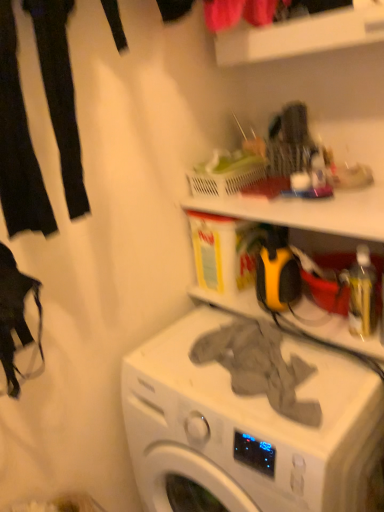
Question: Are gray fabric at center and translucent plastic basket at upper center located far from each other?

Choices:
 (A) no
 (B) yes

Answer: (A)

Question: Could you tell me if gray fabric at center is turned towards translucent plastic basket at upper center?

Choices:
 (A) yes
 (B) no

Answer: (B)

Question: From a real-world perspective, is gray fabric at center located beneath translucent plastic basket at upper center?

Choices:
 (A) yes
 (B) no

Answer: (A)

Question: Does gray fabric at center appear on the right side of translucent plastic basket at upper center?

Choices:
 (A) no
 (B) yes

Answer: (B)

Question: Does gray fabric at center have a greater width compared to translucent plastic basket at upper center?

Choices:
 (A) no
 (B) yes

Answer: (B)

Question: Is the position of gray fabric at center more distant than that of translucent plastic basket at upper center?

Choices:
 (A) yes
 (B) no

Answer: (B)

Question: From the image's perspective, is black fabric pants at left, which is the 1th clothing in left-to-right order, on translucent plastic basket at upper center?

Choices:
 (A) yes
 (B) no

Answer: (A)

Question: Can you confirm if black fabric pants at left, the second clothing from the right, is thinner than translucent plastic basket at upper center?

Choices:
 (A) no
 (B) yes

Answer: (B)

Question: Is black fabric pants at left, which is counted as the 1th clothing, starting from the top, to the right of translucent plastic basket at upper center from the viewer's perspective?

Choices:
 (A) yes
 (B) no

Answer: (B)

Question: Considering the relative positions of black fabric pants at left, the second clothing from the right, and translucent plastic basket at upper center in the image provided, is black fabric pants at left, the second clothing from the right, to the left of translucent plastic basket at upper center from the viewer's perspective?

Choices:
 (A) no
 (B) yes

Answer: (B)

Question: Does black fabric pants at left, which is the 1th clothing in left-to-right order, have a lesser height compared to translucent plastic basket at upper center?

Choices:
 (A) yes
 (B) no

Answer: (B)

Question: Is black fabric pants at left, the second clothing ordered from the bottom, positioned in front of translucent plastic basket at upper center?

Choices:
 (A) no
 (B) yes

Answer: (B)

Question: Is black fabric pants at left, which is the 1th clothing in left-to-right order, facing towards gray fabric at center, acting as the 1th clothing starting from the right?

Choices:
 (A) yes
 (B) no

Answer: (B)